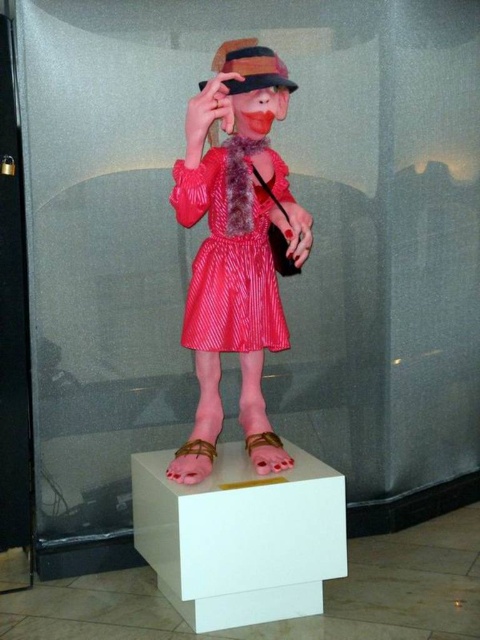
You are an interior designer arranging items on a shelf. You have a white matte box at center and a pink matte sandal at lower center. According to the image, which object is located to the left of the other?

The white matte box at center is positioned on the left side of pink matte sandal at lower center.

You are an artist trying to sketch the figure on the pedestal. You notice two points on the figure, one at point [254,225] and the other at point [188,476]. Which point is closer to you when observing the figure?

Point [254,225] is further to the viewer than point [188,476], so the point at [254,225] is closer to you.

You are a fashion designer observing the image. You need to determine the placement of the shiny satin dress at center and the leather at center. Which object is located to the left of the other?

The shiny satin dress at center is positioned on the right side of leather at center, so the leather at center is to the left of the shiny satin dress at center.